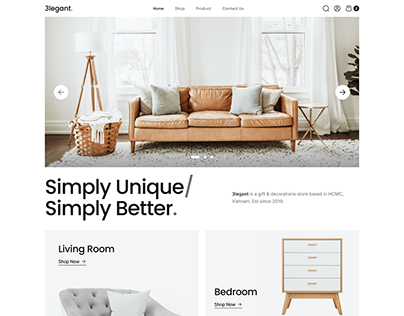
Where is `windows`? The height and width of the screenshot is (316, 404). windows is located at coordinates pos(134,53), pos(285,47).